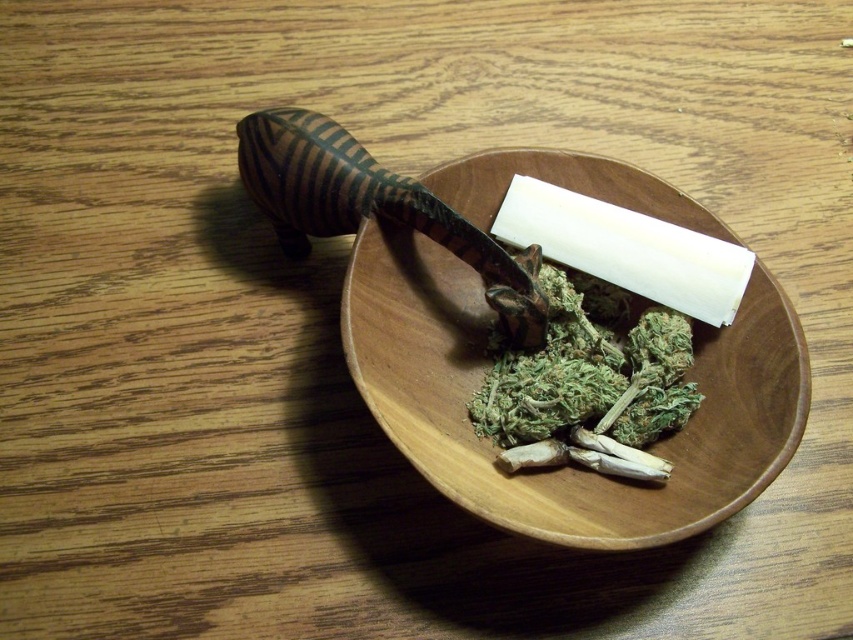
Does wooden bowl at center have a greater width compared to green leafy material at center?

Indeed, wooden bowl at center has a greater width compared to green leafy material at center.

Is point (619, 483) behind point (581, 444)?

No, (619, 483) is in front of (581, 444).

The width and height of the screenshot is (853, 640). In order to click on wooden bowl at center in this screenshot , I will do `click(566, 468)`.